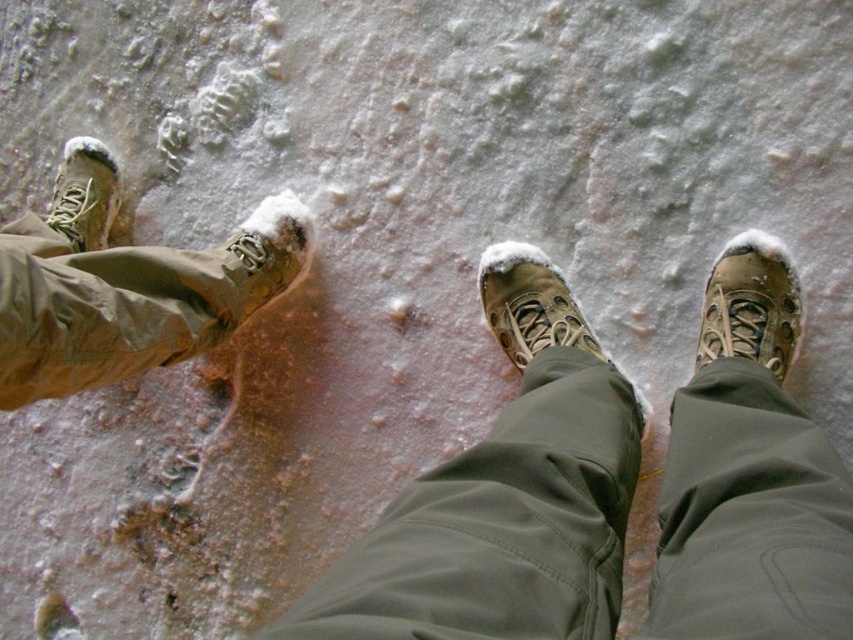
You are planning to take a photo of the brown suede boot at center and matte brown boot at left. Since they are on a snowy slope, you need to know their positions relative to each other. Which boot is lower down the slope?

The brown suede boot at center is located below matte brown boot at left, so it is lower down the slope.